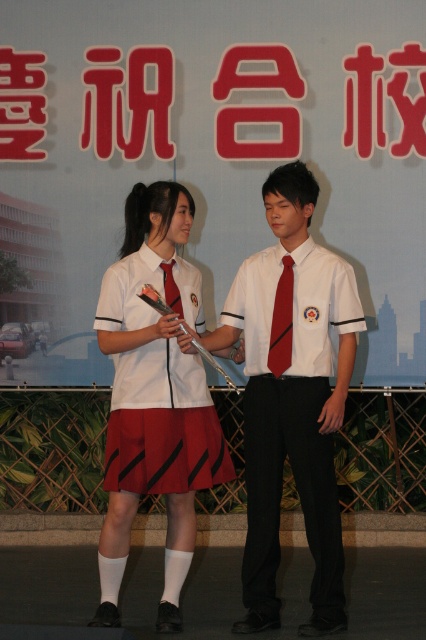
Question: Does red plastic sign at upper center appear on the right side of red satin tie at center?

Choices:
 (A) yes
 (B) no

Answer: (B)

Question: Which point is farther from the camera taking this photo?

Choices:
 (A) (239, 317)
 (B) (278, 356)
 (C) (172, 284)
 (D) (267, 113)

Answer: (D)

Question: Where is red plastic sign at upper center located in relation to matte white shirt at center in the image?

Choices:
 (A) right
 (B) left

Answer: (B)

Question: Is red plastic sign at upper center to the left of matte red tie at center from the viewer's perspective?

Choices:
 (A) no
 (B) yes

Answer: (B)

Question: Which of the following is the farthest from the observer?

Choices:
 (A) (291, 403)
 (B) (180, 352)
 (C) (288, 308)
 (D) (172, 259)

Answer: (D)

Question: Which object is the farthest from the red plastic sign at upper center?

Choices:
 (A) red satin tie at center
 (B) matte red tie at center

Answer: (A)